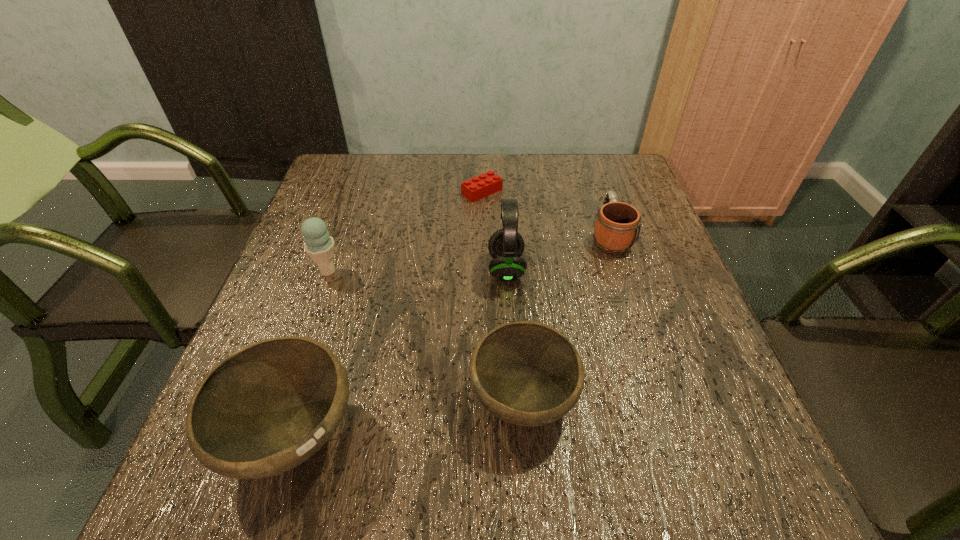
This screenshot has height=540, width=960. Find the location of `free space that is in between the ice cream and the right bowl`. free space that is in between the ice cream and the right bowl is located at coordinates (425, 335).

This screenshot has height=540, width=960. Find the location of `blank region between the headset and the left bowl`. blank region between the headset and the left bowl is located at coordinates (400, 352).

This screenshot has height=540, width=960. I want to click on free space between the farthest object and the shorter bowl, so click(x=502, y=295).

Identify the location of vacant region between the taller bowl and the headset. The image size is (960, 540). pos(400,352).

You are a GUI agent. You are given a task and a screenshot of the screen. Output one action in this format:
    pyautogui.click(x=<x>, y=<y>)
    Task: Click on the free space between the taller bowl and the third shortest object
    
    Given the screenshot: What is the action you would take?
    pyautogui.click(x=408, y=418)

You are a GUI agent. You are given a task and a screenshot of the screen. Output one action in this format:
    pyautogui.click(x=<x>, y=<y>)
    Task: Click on the vacant point located between the ice cream and the shorter bowl
    The width and height of the screenshot is (960, 540).
    Given the screenshot: What is the action you would take?
    pyautogui.click(x=425, y=335)

This screenshot has width=960, height=540. Identify the location of vacant area between the fourth tallest object and the left bowl. (408, 418).

This screenshot has width=960, height=540. I want to click on empty space between the shorter bowl and the left bowl, so click(408, 418).

Image resolution: width=960 pixels, height=540 pixels. In order to click on vacant area between the shortest object and the left bowl in this screenshot , I will do `click(388, 314)`.

Locate which object ranks third in proximity to the fourth tallest object. Please provide its 2D coordinates. Your answer should be formatted as a tuple, i.e. [(x, y)], where the tuple contains the x and y coordinates of a point satisfying the conditions above.

[(617, 226)]